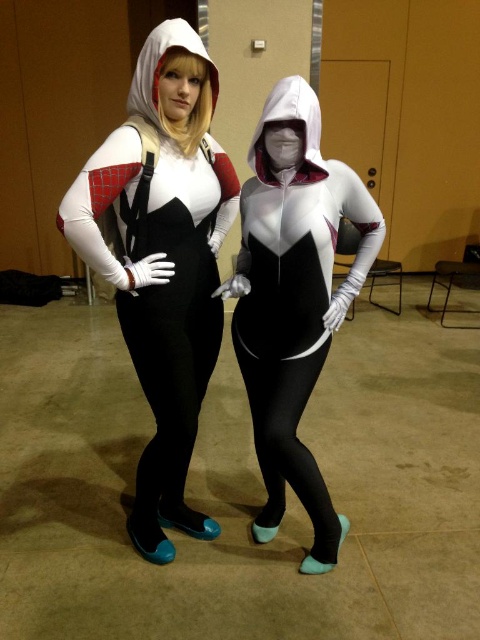
Question: Can you confirm if matte white bodysuit at center is smaller than white matte bodysuit at center?

Choices:
 (A) yes
 (B) no

Answer: (B)

Question: Which object is closer to the camera taking this photo?

Choices:
 (A) matte white bodysuit at center
 (B) white matte bodysuit at center

Answer: (A)

Question: Among these objects, which one is nearest to the camera?

Choices:
 (A) matte white bodysuit at center
 (B) white matte bodysuit at center

Answer: (A)

Question: Can you confirm if matte white bodysuit at center is smaller than white matte bodysuit at center?

Choices:
 (A) no
 (B) yes

Answer: (A)

Question: Does matte white bodysuit at center have a larger size compared to white matte bodysuit at center?

Choices:
 (A) no
 (B) yes

Answer: (B)

Question: Among these points, which one is farthest from the camera?

Choices:
 (A) (279, 420)
 (B) (384, 225)

Answer: (B)